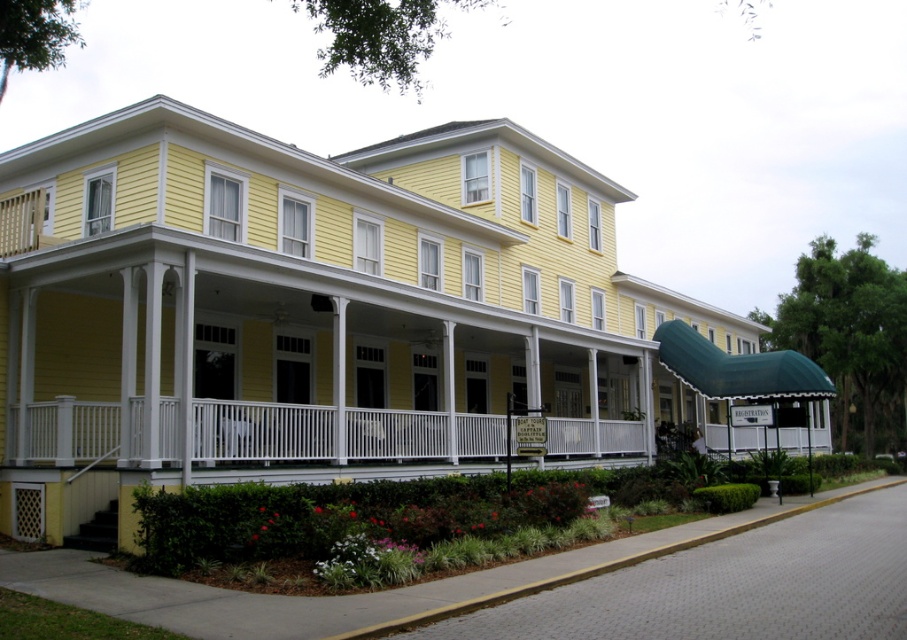
Which is more to the right, white painted wood porch at center or yellow concrete curb at lower center?

yellow concrete curb at lower center is more to the right.

In the scene shown: Does white painted wood porch at center have a greater height compared to yellow concrete curb at lower center?

In fact, white painted wood porch at center may be shorter than yellow concrete curb at lower center.

Between point (558, 432) and point (434, 620), which one is positioned behind?

Point (558, 432)

Where is `white painted wood porch at center`? Image resolution: width=907 pixels, height=640 pixels. white painted wood porch at center is located at coordinates (261, 432).